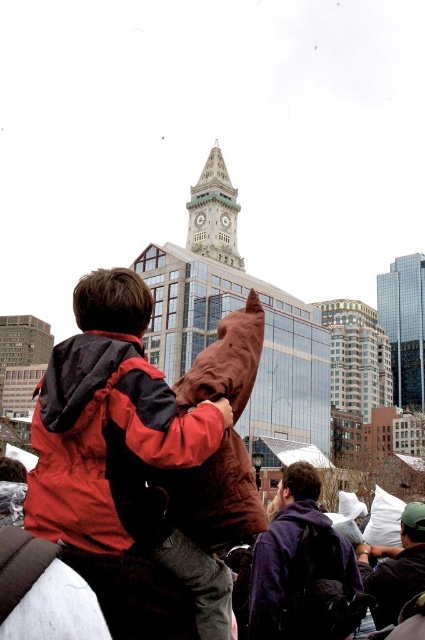
Question: Which object appears farthest from the camera in this image?

Choices:
 (A) matte brown pillow at center
 (B) green stone clock tower at center
 (C) glassy reflective skyscraper at upper center
 (D) dark blue fleece jacket at center

Answer: (C)

Question: Does dark gray hoodie at lower right have a smaller size compared to green stone clock tower at center?

Choices:
 (A) yes
 (B) no

Answer: (A)

Question: Which point is farther from the camera taking this photo?

Choices:
 (A) (387, 616)
 (B) (62, 369)
 (C) (286, 477)

Answer: (C)

Question: Which is nearer to the green stone clock tower at center?

Choices:
 (A) glassy reflective skyscraper at upper center
 (B) dark gray hoodie at lower right

Answer: (A)

Question: Does matte brown pillow at center appear over dark blue fleece jacket at center?

Choices:
 (A) yes
 (B) no

Answer: (A)

Question: Where is glassy reflective skyscraper at upper center located in relation to dark gray hoodie at lower right in the image?

Choices:
 (A) below
 (B) above

Answer: (B)